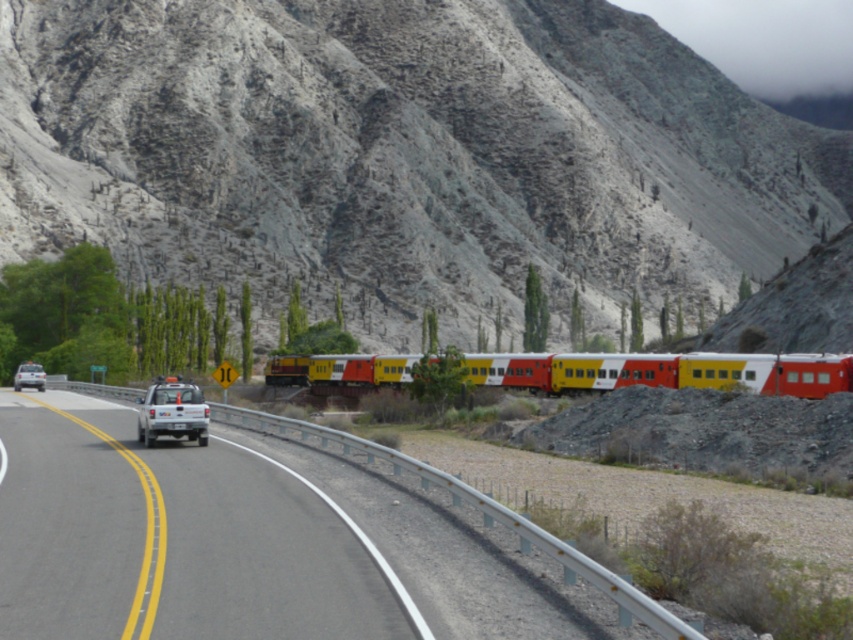
Does rugged stone mountain at center have a greater width compared to yellow matte train at center?

Yes, rugged stone mountain at center is wider than yellow matte train at center.

Who is positioned more to the left, rugged stone mountain at center or yellow matte train at center?

From the viewer's perspective, yellow matte train at center appears more on the left side.

From the picture: Who is more distant from viewer, [380,266] or [473,355]?

The point [380,266] is behind.

Find the location of a particular element. This screenshot has height=640, width=853. rugged stone mountain at center is located at coordinates (401, 156).

Who is higher up, white glossy pickup truck at center or yellow matte train at center?

Positioned higher is yellow matte train at center.

Does point (256, 577) come behind point (387, 372)?

No, (256, 577) is closer to viewer.

I want to click on white glossy pickup truck at center, so coord(173,540).

How much distance is there between yellow matte train at center and metallic train track at center?

yellow matte train at center is 42.28 meters from metallic train track at center.

Who is shorter, yellow matte train at center or metallic train track at center?

metallic train track at center is shorter.

This screenshot has height=640, width=853. What do you see at coordinates (663, 371) in the screenshot? I see `yellow matte train at center` at bounding box center [663, 371].

Where is `yellow matte train at center`? yellow matte train at center is located at coordinates (663, 371).